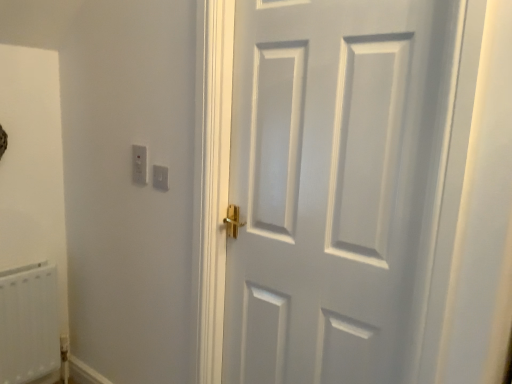
Question: Does white plastic radiator at lower left have a lesser height compared to white matte door at center?

Choices:
 (A) no
 (B) yes

Answer: (B)

Question: Is white plastic radiator at lower left positioned behind white matte door at center?

Choices:
 (A) no
 (B) yes

Answer: (B)

Question: Can you confirm if white plastic radiator at lower left is smaller than white matte door at center?

Choices:
 (A) yes
 (B) no

Answer: (A)

Question: Would you say white matte door at center is part of white plastic radiator at lower left's contents?

Choices:
 (A) yes
 (B) no

Answer: (B)

Question: Are white plastic radiator at lower left and white matte door at center beside each other?

Choices:
 (A) yes
 (B) no

Answer: (B)

Question: Is white matte door at center wider or thinner than white plastic radiator at lower left?

Choices:
 (A) thin
 (B) wide

Answer: (A)

Question: Is white matte door at center bigger or smaller than white plastic radiator at lower left?

Choices:
 (A) big
 (B) small

Answer: (A)

Question: Which is correct: white matte door at center is inside white plastic radiator at lower left, or outside of it?

Choices:
 (A) inside
 (B) outside

Answer: (B)

Question: Is point (343, 110) closer or farther from the camera than point (30, 362)?

Choices:
 (A) farther
 (B) closer

Answer: (B)

Question: Considering the relative positions of white plastic light switch at upper left and white matte door at center in the image provided, is white plastic light switch at upper left to the left or to the right of white matte door at center?

Choices:
 (A) left
 (B) right

Answer: (A)

Question: Is point (165, 188) positioned closer to the camera than point (361, 178)?

Choices:
 (A) closer
 (B) farther

Answer: (B)

Question: From a real-world perspective, relative to white matte door at center, is white plastic light switch at upper left vertically above or below?

Choices:
 (A) below
 (B) above

Answer: (B)

Question: Is white plastic light switch at upper left inside or outside of white matte door at center?

Choices:
 (A) inside
 (B) outside

Answer: (B)

Question: From a real-world perspective, is white plastic light switch at upper left positioned above or below white plastic radiator at lower left?

Choices:
 (A) below
 (B) above

Answer: (B)

Question: Does point (156, 183) appear closer or farther from the camera than point (16, 302)?

Choices:
 (A) farther
 (B) closer

Answer: (B)